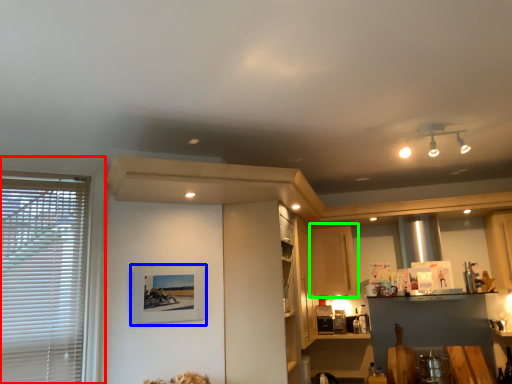
Question: Which object is positioned closest to window (highlighted by a red box)? Select from picture frame (highlighted by a blue box) and cabinetry (highlighted by a green box).

Choices:
 (A) picture frame
 (B) cabinetry

Answer: (A)